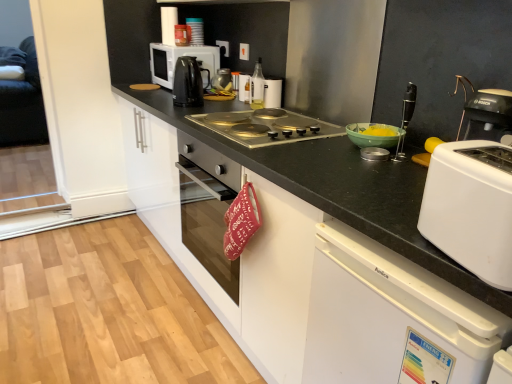
Where is `vacant area situated to the left side of green matte bowl at right`? vacant area situated to the left side of green matte bowl at right is located at coordinates (324, 144).